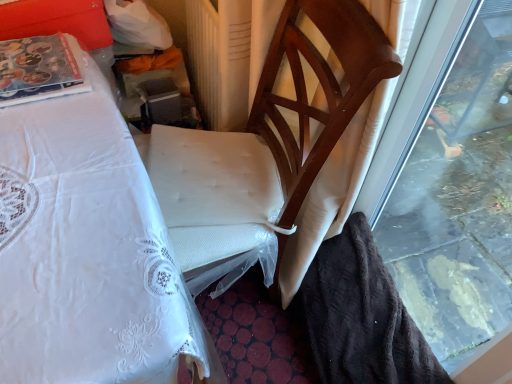
Locate an element on the screen. The width and height of the screenshot is (512, 384). transparent glass window at right is located at coordinates (460, 209).

Is wooden chair at center smaller than transparent glass window at right?

Actually, wooden chair at center might be larger than transparent glass window at right.

Which object is thinner, wooden chair at center or transparent glass window at right?

With smaller width is transparent glass window at right.

Looking at this image, is wooden chair at center facing away from transparent glass window at right?

No, transparent glass window at right is not at the back of wooden chair at center.

Which point is more distant from viewer, (173, 195) or (490, 345)?

The point (173, 195) is farther from the camera.

Is point (320, 62) closer to viewer compared to point (223, 110)?

Yes, it is.

From the image's perspective, is wooden chair at center below beige textured radiator at center?

Indeed, from the image's perspective, wooden chair at center is shown beneath beige textured radiator at center.

Between wooden chair at center and beige textured radiator at center, which one appears on the left side from the viewer's perspective?

Positioned to the left is beige textured radiator at center.

How different are the orientations of wooden chair at center and beige textured radiator at center in degrees?

wooden chair at center and beige textured radiator at center are facing 95 degrees away from each other.

Is point (462, 295) in front of point (362, 8)?

No, (462, 295) is behind (362, 8).

Is transparent glass window at right with wooden chair at center?

No.

Is transparent glass window at right wider than wooden chair at center?

No, transparent glass window at right is not wider than wooden chair at center.

Is transparent glass window at right not within wooden chair at center?

Yes, transparent glass window at right is not within wooden chair at center.

Image resolution: width=512 pixels, height=384 pixels. I want to click on radiator above the wooden chair at center (from the image's perspective), so click(220, 60).

Does beige textured radiator at center have a lesser width compared to wooden chair at center?

No, beige textured radiator at center is not thinner than wooden chair at center.

Consider the image. Could you tell me if beige textured radiator at center is facing wooden chair at center?

Yes, beige textured radiator at center is aimed at wooden chair at center.

Which point is more forward, (211, 107) or (227, 145)?

The point (227, 145) is more forward.

Is point (216, 58) less distant than point (499, 181)?

Yes, it is in front of point (499, 181).

How much distance is there between beige textured radiator at center and transparent glass window at right?

beige textured radiator at center is 34.45 inches away from transparent glass window at right.

In the scene shown: Which object is further away from the camera taking this photo, beige textured radiator at center or transparent glass window at right?

beige textured radiator at center is further away from the camera.

Considering the sizes of beige textured radiator at center and transparent glass window at right in the image, is beige textured radiator at center taller or shorter than transparent glass window at right?

beige textured radiator at center is shorter than transparent glass window at right.

Between transparent glass window at right and beige textured radiator at center, which one has larger width?

beige textured radiator at center is wider.

Is transparent glass window at right to the right of beige textured radiator at center from the viewer's perspective?

Indeed, transparent glass window at right is positioned on the right side of beige textured radiator at center.

From a real-world perspective, between transparent glass window at right and beige textured radiator at center, who is vertically higher?

From a 3D spatial view, transparent glass window at right is above.

Who is more distant, transparent glass window at right or beige textured radiator at center?

beige textured radiator at center is further from the camera.

At what (x,y) coordinates should I click in order to perform the action: click on window located below the wooden chair at center (from the image's perspective). Please return your answer as a coordinate pair (x, y). Looking at the image, I should click on (460, 209).

Identify the location of chair that is on the right side of beige textured radiator at center. Image resolution: width=512 pixels, height=384 pixels. (266, 138).

Which object lies further to the anchor point transparent glass window at right, beige textured radiator at center or wooden chair at center?

beige textured radiator at center lies further to transparent glass window at right than the other object.

When comparing their distances from wooden chair at center, does transparent glass window at right or beige textured radiator at center seem further?

Based on the image, transparent glass window at right appears to be further to wooden chair at center.

From the image, which object appears to be farther from beige textured radiator at center, transparent glass window at right or wooden chair at center?

transparent glass window at right lies further to beige textured radiator at center than the other object.

Which object lies nearer to the anchor point beige textured radiator at center, wooden chair at center or transparent glass window at right?

wooden chair at center is closer to beige textured radiator at center.

Looking at the image, which one is located further to wooden chair at center, beige textured radiator at center or transparent glass window at right?

transparent glass window at right is positioned further to the anchor wooden chair at center.

Based on their spatial positions, is wooden chair at center or beige textured radiator at center further from transparent glass window at right?

beige textured radiator at center lies further to transparent glass window at right than the other object.

Locate an element on the screen. The image size is (512, 384). chair positioned between transparent glass window at right and beige textured radiator at center from near to far is located at coordinates (266, 138).